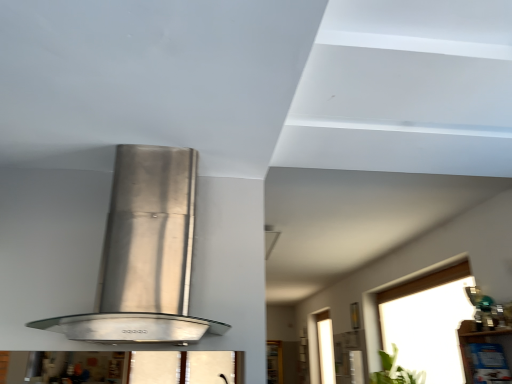
What do you see at coordinates (428, 322) in the screenshot?
I see `clear glass window at upper right` at bounding box center [428, 322].

Locate an element on the screen. Image resolution: width=512 pixels, height=384 pixels. satin silver range hood at center is located at coordinates (145, 255).

Looking at this image, measure the distance between point (164, 325) and camera.

Point (164, 325) is 4.97 feet from camera.

At what (x,y) coordinates should I click in order to perform the action: click on clear glass window at upper right. Please return your answer as a coordinate pair (x, y). The height and width of the screenshot is (384, 512). Looking at the image, I should click on (428, 322).

Which is closer to the camera, [125,187] or [424,373]?

Point [125,187] is closer to the camera than point [424,373].

Is satin silver range hood at center facing towards green leafy plant at lower right?

No, satin silver range hood at center is not facing towards green leafy plant at lower right.

Is satin silver range hood at center with green leafy plant at lower right?

No, satin silver range hood at center is not touching green leafy plant at lower right.

From a real-world perspective, between satin silver range hood at center and green leafy plant at lower right, who is vertically higher?

satin silver range hood at center, from a real-world perspective.

Which object is further away from the camera, clear glass window at upper right or green leafy plant at lower right?

green leafy plant at lower right is more distant.

Is point (428, 362) closer to camera compared to point (391, 380)?

Yes, point (428, 362) is closer to viewer.

Considering the sizes of objects clear glass window at upper right and green leafy plant at lower right in the image provided, who is wider, clear glass window at upper right or green leafy plant at lower right?

green leafy plant at lower right is wider.

Is clear glass window at upper right positioned with its back to green leafy plant at lower right?

Yes, clear glass window at upper right is facing away from green leafy plant at lower right.

Is satin silver range hood at center bigger than clear glass window at upper right?

No, satin silver range hood at center is not bigger than clear glass window at upper right.

From a real-world perspective, is satin silver range hood at center physically below clear glass window at upper right?

Incorrect, from a real-world perspective, satin silver range hood at center is higher than clear glass window at upper right.

Is satin silver range hood at center beside clear glass window at upper right?

No, satin silver range hood at center is not making contact with clear glass window at upper right.

In the scene shown: Considering their positions, is green leafy plant at lower right located in front of or behind clear glass window at upper right?

Clearly, green leafy plant at lower right is behind clear glass window at upper right.

Considering the sizes of objects green leafy plant at lower right and clear glass window at upper right in the image provided, who is shorter, green leafy plant at lower right or clear glass window at upper right?

green leafy plant at lower right is shorter.

Does green leafy plant at lower right have a larger size compared to clear glass window at upper right?

Actually, green leafy plant at lower right might be smaller than clear glass window at upper right.

From a real-world perspective, which object rests below the other?

clear glass window at upper right, from a real-world perspective.

Considering the positions of objects clear glass window at upper right and satin silver range hood at center in the image provided, who is more to the left, clear glass window at upper right or satin silver range hood at center?

Positioned to the left is satin silver range hood at center.

Is clear glass window at upper right taller than satin silver range hood at center?

Indeed, clear glass window at upper right has a greater height compared to satin silver range hood at center.

Looking at their sizes, would you say green leafy plant at lower right is wider or thinner than satin silver range hood at center?

Considering their sizes, green leafy plant at lower right looks slimmer than satin silver range hood at center.

From a real-world perspective, is green leafy plant at lower right above or below satin silver range hood at center?

From a real-world perspective, green leafy plant at lower right is physically below satin silver range hood at center.

From the image's perspective, is green leafy plant at lower right located above or below satin silver range hood at center?

green leafy plant at lower right is below satin silver range hood at center.

Locate an element on the screen. kitchen appliance located on the left of green leafy plant at lower right is located at coordinates (145, 255).

Locate an element on the screen. The image size is (512, 384). window in front of the green leafy plant at lower right is located at coordinates (428, 322).

Based on their spatial positions, is satin silver range hood at center or green leafy plant at lower right further from clear glass window at upper right?

Based on the image, satin silver range hood at center appears to be further to clear glass window at upper right.

Based on their spatial positions, is satin silver range hood at center or clear glass window at upper right closer to green leafy plant at lower right?

clear glass window at upper right lies closer to green leafy plant at lower right than the other object.

Based on the photo, which object lies further to the anchor point satin silver range hood at center, green leafy plant at lower right or clear glass window at upper right?

Based on the image, green leafy plant at lower right appears to be further to satin silver range hood at center.

Looking at the image, which one is located closer to satin silver range hood at center, clear glass window at upper right or green leafy plant at lower right?

Based on the image, clear glass window at upper right appears to be nearer to satin silver range hood at center.

When comparing their distances from green leafy plant at lower right, does clear glass window at upper right or satin silver range hood at center seem closer?

clear glass window at upper right lies closer to green leafy plant at lower right than the other object.

Which object lies further to the anchor point clear glass window at upper right, green leafy plant at lower right or satin silver range hood at center?

satin silver range hood at center is further to clear glass window at upper right.

Locate an element on the screen. The image size is (512, 384). window between satin silver range hood at center and green leafy plant at lower right from front to back is located at coordinates (428, 322).